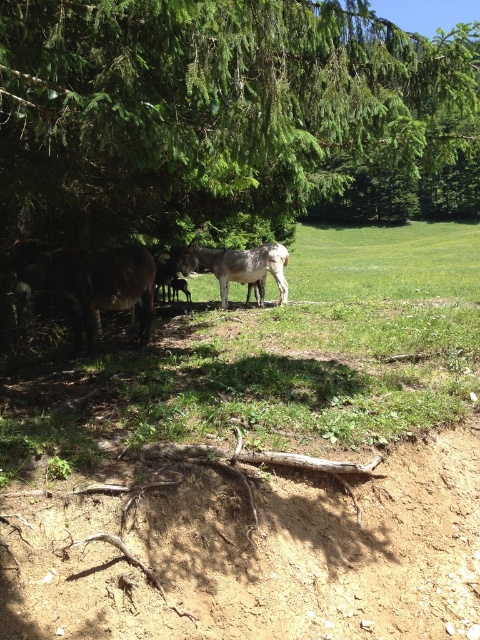
Which is more to the left, green leafy tree at center or green grassy at lower center?

Positioned to the left is green leafy tree at center.

What are the coordinates of `green leafy tree at center` in the screenshot? It's located at (210, 108).

Is green grassy at lower center smaller than gray matte donkey at center?

No.

Is the position of green grassy at lower center less distant than that of gray matte donkey at center?

Yes, it is.

Measure the distance between point (417, 332) and camera.

Point (417, 332) and camera are 7.24 meters apart from each other.

Where is `green grassy at lower center`? green grassy at lower center is located at coordinates (274, 356).

Find the location of a particular element. green leafy tree at center is located at coordinates (210, 108).

Who is taller, green leafy tree at center or gray matte donkey at center?

With more height is green leafy tree at center.

Who is more distant from viewer, (298, 170) or (217, 280)?

Positioned behind is point (217, 280).

Where is `green leafy tree at center`? This screenshot has width=480, height=640. green leafy tree at center is located at coordinates (210, 108).